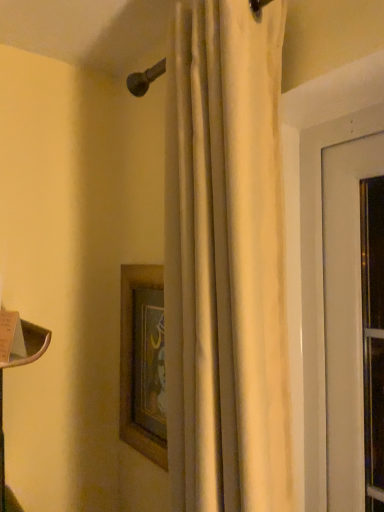
Question: Is wooden framed picture at center wider or thinner than white matte curtain at center?

Choices:
 (A) thin
 (B) wide

Answer: (A)

Question: Is wooden framed picture at center spatially inside white matte curtain at center, or outside of it?

Choices:
 (A) outside
 (B) inside

Answer: (A)

Question: From the image's perspective, is wooden framed picture at center positioned above or below white matte curtain at center?

Choices:
 (A) above
 (B) below

Answer: (B)

Question: Does point (211, 1) appear closer or farther from the camera than point (150, 439)?

Choices:
 (A) farther
 (B) closer

Answer: (B)

Question: Considering the positions of white matte curtain at center and wooden framed picture at center in the image, is white matte curtain at center taller or shorter than wooden framed picture at center?

Choices:
 (A) short
 (B) tall

Answer: (B)

Question: Is white matte curtain at center in front of or behind wooden framed picture at center in the image?

Choices:
 (A) front
 (B) behind

Answer: (A)

Question: Is white matte curtain at center bigger or smaller than wooden framed picture at center?

Choices:
 (A) small
 (B) big

Answer: (B)